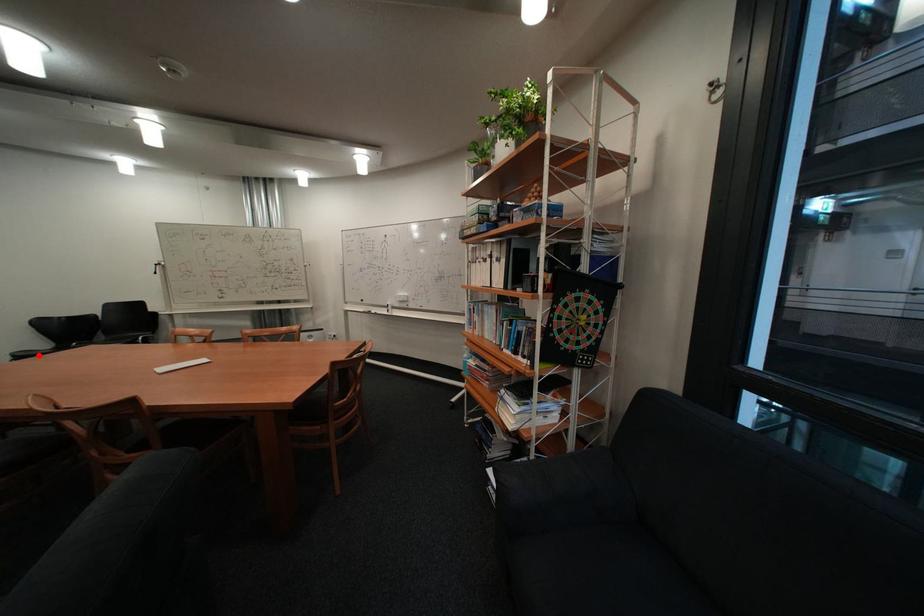
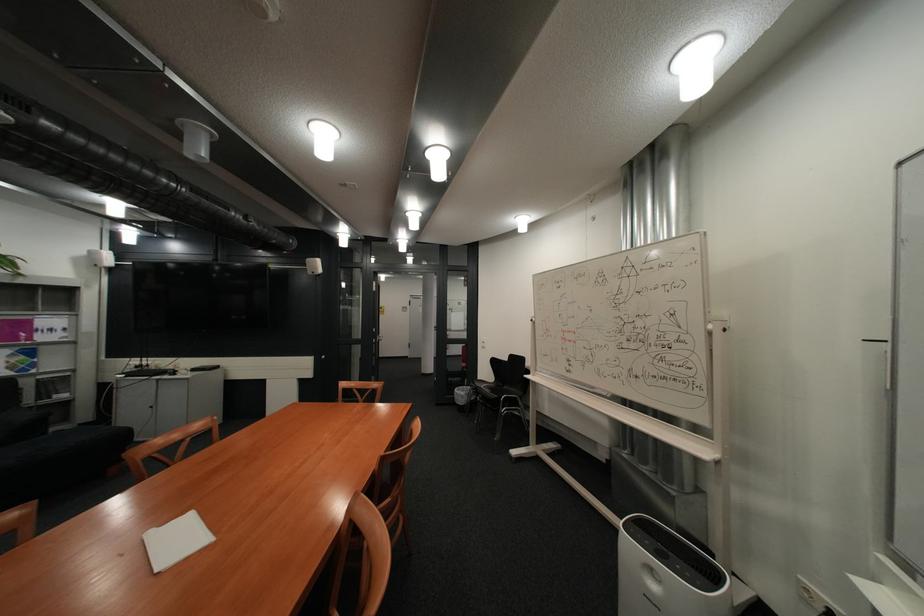
Question: I am providing you with two images of the same scene from different viewpoints. Given a red point in image1, look at the same physical point in image2. Is it:

Choices:
 (A) Closer to the viewpoint
 (B) Farther from the viewpoint

Answer: (A)